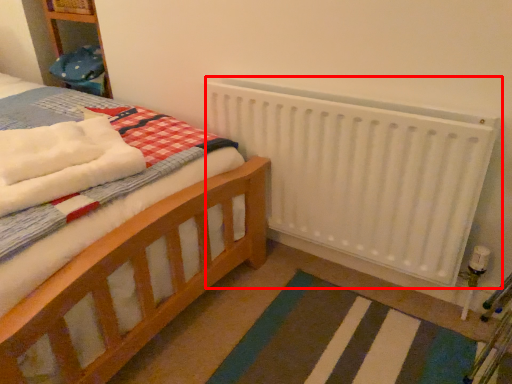
Question: In this image, where is radiator (annotated by the red box) located relative to bath towel?

Choices:
 (A) right
 (B) left

Answer: (A)